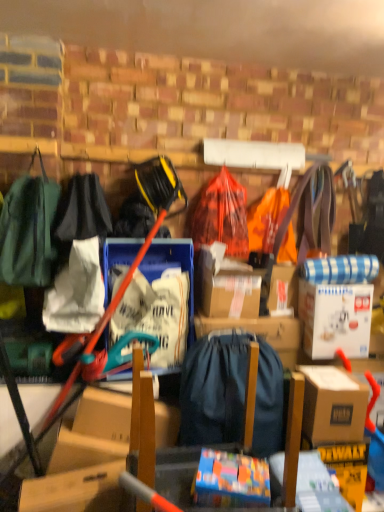
Question: In terms of width, does white fabric bag at center, which is counted as the 3th clothing, starting from the right, look wider or thinner when compared to green fabric backpack at left, which is the fourth clothing in right-to-left order?

Choices:
 (A) wide
 (B) thin

Answer: (B)

Question: Considering their positions, is white fabric bag at center, positioned as the 2th clothing in left-to-right order, located in front of or behind green fabric backpack at left, which is the fourth clothing in right-to-left order?

Choices:
 (A) behind
 (B) front

Answer: (A)

Question: Considering the real-world distances, which object is farthest from the white cardboard box at upper right, which is counted as the 2th box, starting from the bottom?

Choices:
 (A) black fabric bag at left, which is the 3th clothing in left-to-right order
 (B) dark blue fabric backpack at center
 (C) brown cardboard box at right, which appears as the 2th box when viewed from the top
 (D) white plastic bag at center, the 1th storage box viewed from the left
 (E) green fabric backpack at left, which is the fourth clothing in right-to-left order

Answer: (E)

Question: Considering the real-world distances, which object is farthest from the white plastic bag at center, which is the second storage box in right-to-left order?

Choices:
 (A) green fabric backpack at left, which ranks as the 1th clothing in left-to-right order
 (B) white cardboard box at upper right, which is the second box in front-to-back order
 (C) white fabric bag at center, positioned as the 2th clothing in left-to-right order
 (D) brown cardboard box at right, arranged as the 2th box when viewed from the back
 (E) plastic bag at center, which ranks as the 4th clothing in left-to-right order

Answer: (D)